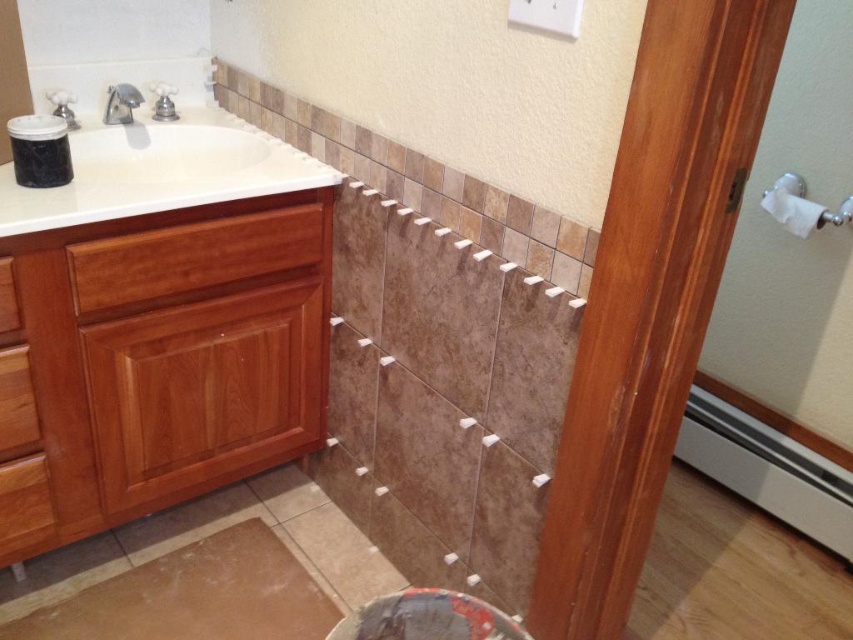
You are a contractor assessing the bathroom layout. You need to move the smooth dark red stool at lower center and the silver metallic faucet at upper left to make space for new fixtures. Which object should you move first to ensure you can access the area behind both?

The smooth dark red stool at lower center is closer to the viewer than the silver metallic faucet at upper left, so you should move the smooth dark red stool at lower center first to access the area behind both.